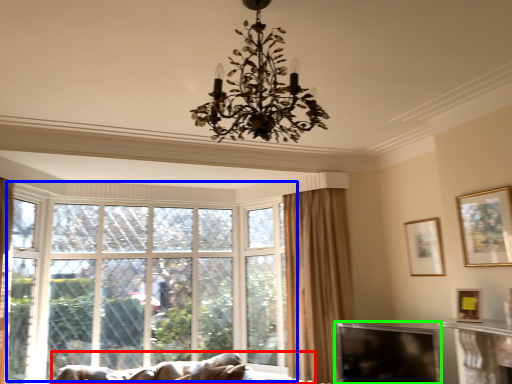
Question: Which is farther away from studio couch (highlighted by a red box)? window (highlighted by a blue box) or window screen (highlighted by a green box)?

Choices:
 (A) window
 (B) window screen

Answer: (B)